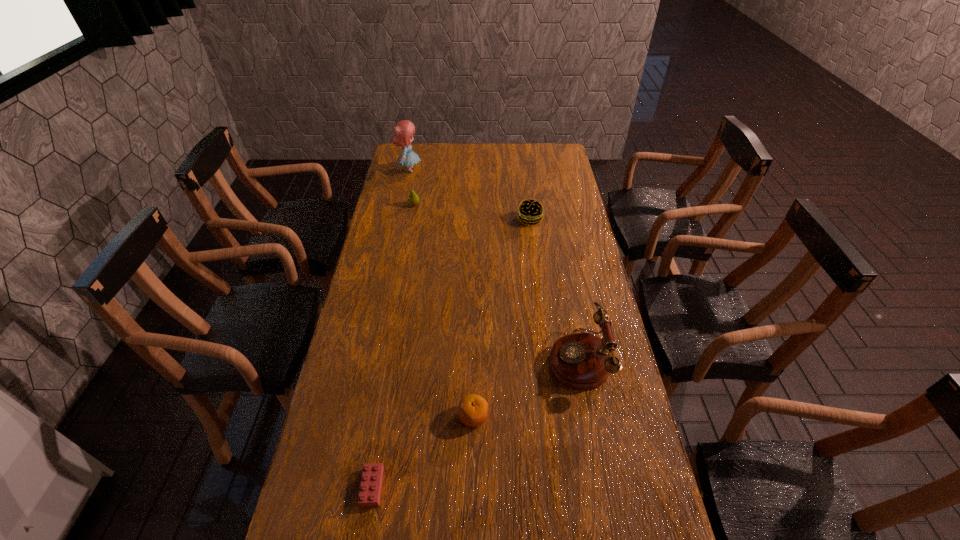
At what (x,y) coordinates should I click in order to perform the action: click on the farthest object. Please return your answer as a coordinate pair (x, y). This screenshot has height=540, width=960. Looking at the image, I should click on (403, 131).

I want to click on doll, so click(403, 131).

Where is `telephone`? telephone is located at coordinates (580, 360).

The height and width of the screenshot is (540, 960). I want to click on the fifth shortest object, so click(x=580, y=360).

Locate an element on the screen. pear is located at coordinates (413, 199).

Locate an element on the screen. the fourth nearest object is located at coordinates (531, 212).

At what (x,y) coordinates should I click in order to perform the action: click on the fifth tallest object. Please return your answer as a coordinate pair (x, y). This screenshot has width=960, height=540. Looking at the image, I should click on (472, 410).

Identify the location of the fifth farthest object. This screenshot has width=960, height=540. (472, 410).

Locate an element on the screen. Lego is located at coordinates (371, 482).

Identify the location of the shortest object. The height and width of the screenshot is (540, 960). (371, 482).